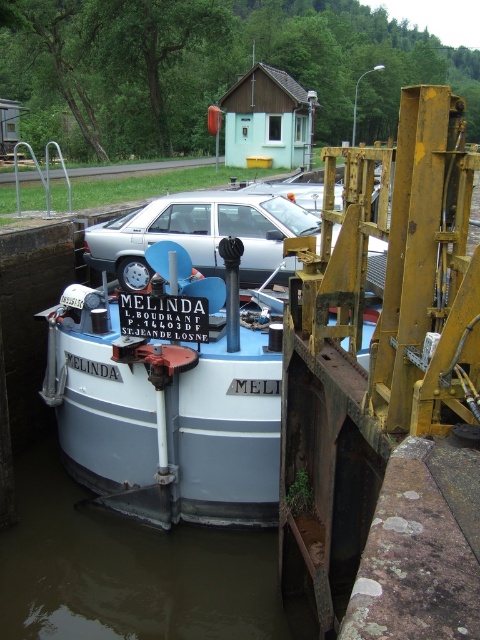
Does brown murky water at lower center come behind matte silver car at center?

No, it is in front of matte silver car at center.

Who is higher up, brown murky water at lower center or matte silver car at center?

matte silver car at center is higher up.

Is point (172, 564) positioned behind point (267, 227)?

No.

Locate an element on the screen. brown murky water at lower center is located at coordinates (130, 570).

Is white matte boat at center positioned behind matte silver car at center?

No.

Can you confirm if white matte boat at center is positioned to the left of matte silver car at center?

Indeed, white matte boat at center is positioned on the left side of matte silver car at center.

Who is more distant from viewer, (214, 401) or (240, 221)?

Positioned behind is point (240, 221).

Find the location of a particular element. This screenshot has width=480, height=640. white matte boat at center is located at coordinates (166, 412).

Which is behind, point (190, 378) or point (60, 497)?

Point (60, 497)

Is the position of white matte boat at center less distant than that of brown murky water at lower center?

That is False.

Where is `white matte boat at center`? The height and width of the screenshot is (640, 480). white matte boat at center is located at coordinates (166, 412).